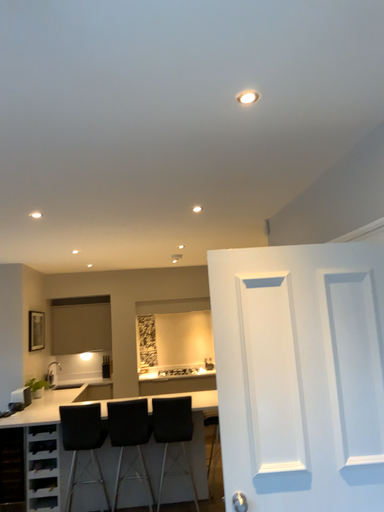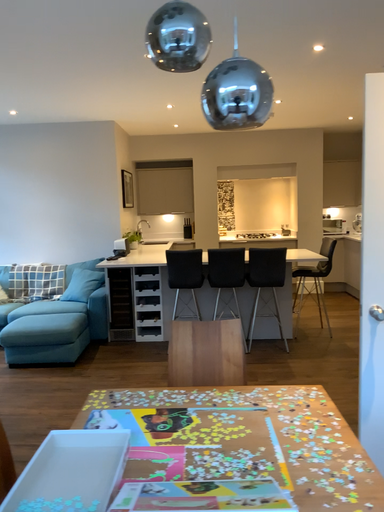
Question: Which way did the camera rotate in the video?

Choices:
 (A) rotated upward
 (B) rotated downward

Answer: (B)